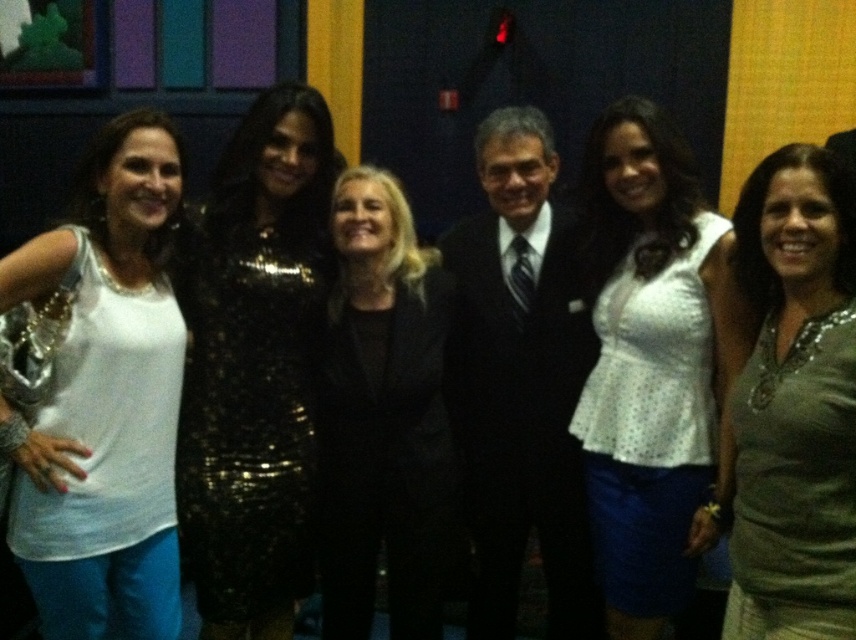
You are a photographer adjusting the camera focus. The white dotted blouse at center and the black suit at center are both in the frame. If the camera can only focus on objects within a 20 cm range of each other, will both items be in focus?

The white dotted blouse at center is 23.70 centimeters away from the black suit at center. Since the distance exceeds the 20 cm range, the camera cannot focus on both items simultaneously.

You are a photographer adjusting the camera settings. You notice two central figures wearing a white dotted blouse at center and a black suit at center. Which one should you focus on first if you want to ensure the taller subject is in sharp focus?

The black suit at center is taller than the white dotted blouse at center, so you should focus on the black suit at center first to ensure the taller subject is in sharp focus.